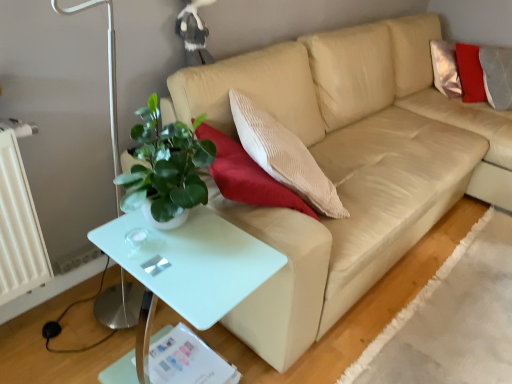
Question: Should I look upward or downward to see beige leather couch at center?

Choices:
 (A) up
 (B) down

Answer: (A)

Question: Is beige leather couch at center located outside white glossy table at lower left?

Choices:
 (A) yes
 (B) no

Answer: (A)

Question: Considering the relative sizes of beige leather couch at center and white glossy table at lower left in the image provided, is beige leather couch at center wider than white glossy table at lower left?

Choices:
 (A) no
 (B) yes

Answer: (B)

Question: Is beige leather couch at center far from white glossy table at lower left?

Choices:
 (A) yes
 (B) no

Answer: (B)

Question: Does beige leather couch at center have a lesser width compared to white glossy table at lower left?

Choices:
 (A) no
 (B) yes

Answer: (A)

Question: Are beige leather couch at center and white glossy table at lower left beside each other?

Choices:
 (A) yes
 (B) no

Answer: (B)

Question: Considering the relative positions of beige leather couch at center and white glossy table at lower left in the image provided, is beige leather couch at center to the right of white glossy table at lower left from the viewer's perspective?

Choices:
 (A) no
 (B) yes

Answer: (B)

Question: Can you confirm if white glossy table at lower left is shorter than beige leather couch at center?

Choices:
 (A) yes
 (B) no

Answer: (A)

Question: Can you confirm if white glossy table at lower left is taller than beige leather couch at center?

Choices:
 (A) yes
 (B) no

Answer: (B)

Question: Considering the relative positions of white glossy table at lower left and beige leather couch at center in the image provided, is white glossy table at lower left in front of beige leather couch at center?

Choices:
 (A) yes
 (B) no

Answer: (A)

Question: Are white glossy table at lower left and beige leather couch at center far apart?

Choices:
 (A) no
 (B) yes

Answer: (A)

Question: Is white glossy table at lower left facing away from beige leather couch at center?

Choices:
 (A) no
 (B) yes

Answer: (A)

Question: From the image's perspective, is white glossy table at lower left on top of beige leather couch at center?

Choices:
 (A) no
 (B) yes

Answer: (A)

Question: From their relative heights in the image, would you say white glossy table at lower left is taller or shorter than beige leather couch at center?

Choices:
 (A) tall
 (B) short

Answer: (B)